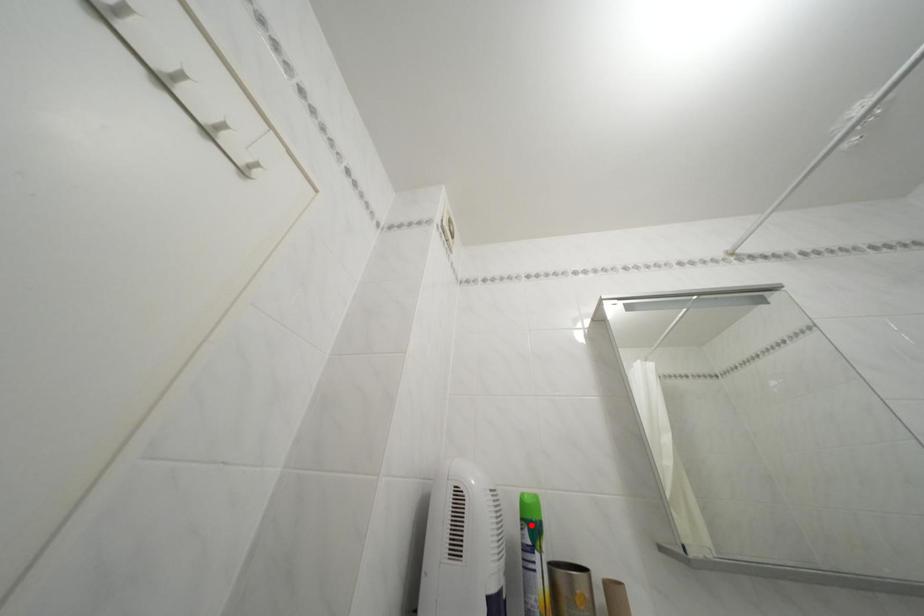
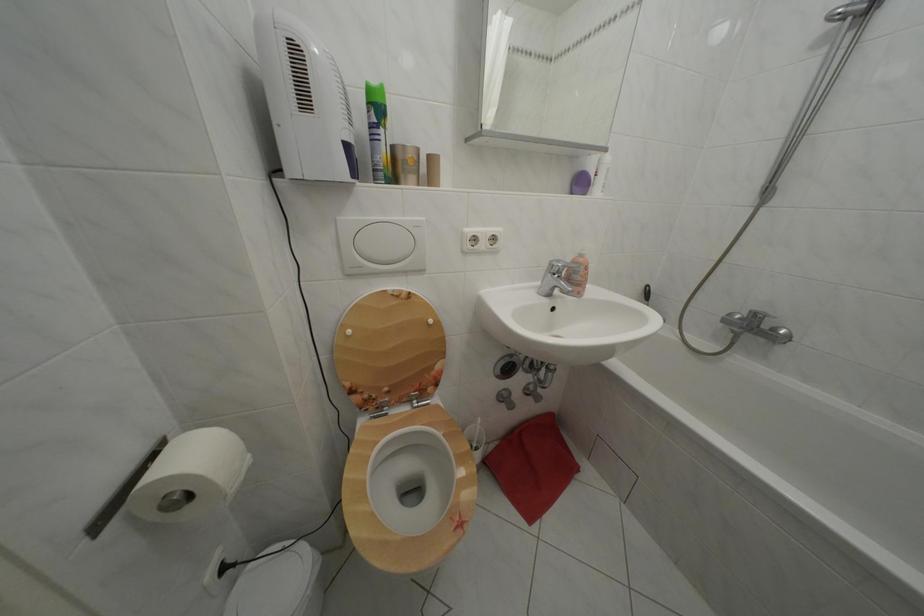
Where in the second image is the point corresponding to the highlighted location from the first image?

(378, 110)